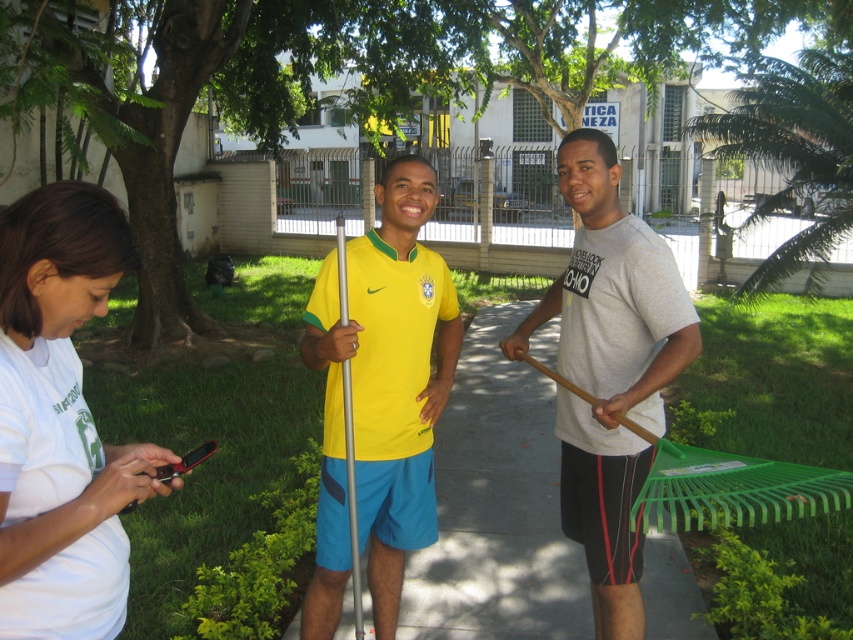
Is yellow matte jersey at center positioned at the back of gray cotton t-shirt at center?

No.

Between point (426, 408) and point (642, 248), which one is positioned in front?

Point (642, 248) is in front.

Does point (334, 307) come closer to viewer compared to point (585, 486)?

Yes, it is in front of point (585, 486).

Where is `yellow matte jersey at center`? Image resolution: width=853 pixels, height=640 pixels. yellow matte jersey at center is located at coordinates (381, 396).

Which is more to the left, smooth concrete pavement at center or yellow matte jersey at center?

Positioned to the left is yellow matte jersey at center.

Measure the distance between smooth concrete pavement at center and camera.

smooth concrete pavement at center and camera are 3.36 meters apart.

Does point (659, 563) come behind point (386, 614)?

Yes, it is.

Where is `smooth concrete pavement at center`? Image resolution: width=853 pixels, height=640 pixels. smooth concrete pavement at center is located at coordinates (496, 508).

Is white matte shirt at lower left below smooth concrete pavement at center?

Incorrect, white matte shirt at lower left is not positioned below smooth concrete pavement at center.

Is white matte shirt at lower left wider than smooth concrete pavement at center?

In fact, white matte shirt at lower left might be narrower than smooth concrete pavement at center.

Is point (24, 337) positioned behind point (448, 422)?

No, it is not.

This screenshot has width=853, height=640. Identify the location of white matte shirt at lower left. (61, 419).